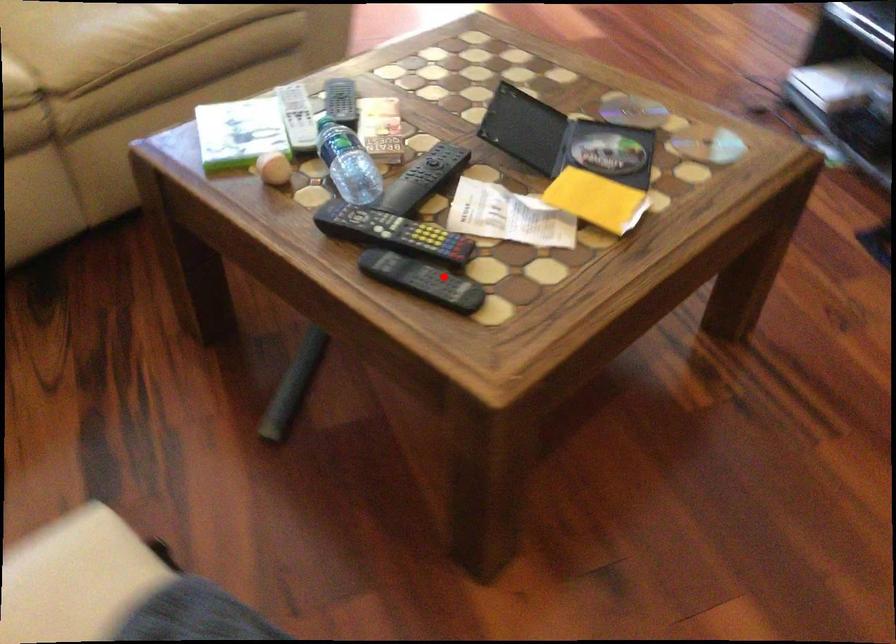
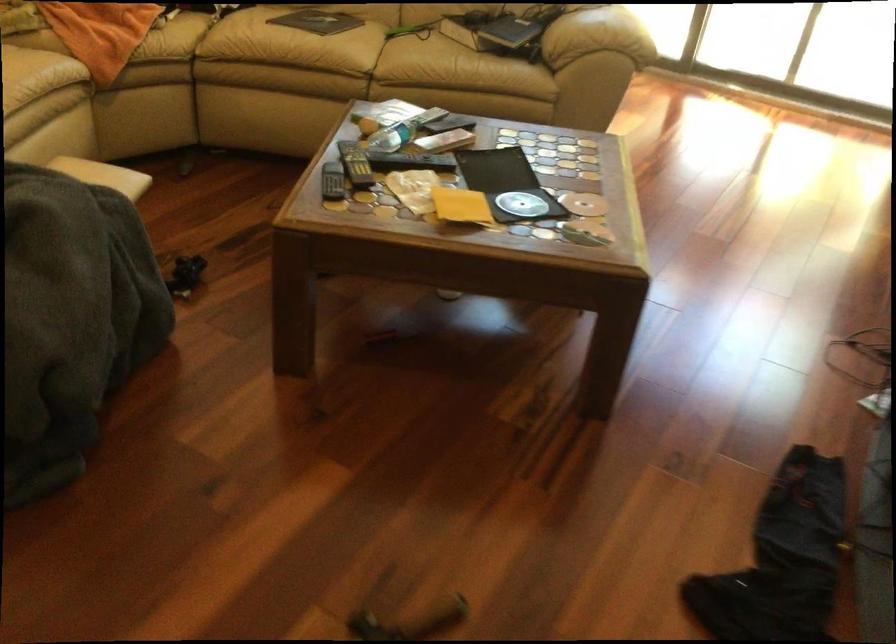
The point at the highlighted location is marked in the first image. Where is the corresponding point in the second image?

(332, 182)